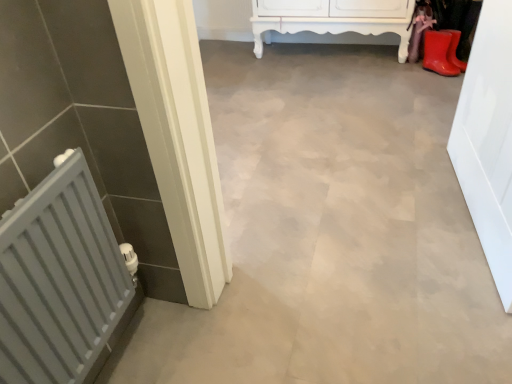
Question: Is the depth of rubber matte boot at upper right greater than that of white glossy door at right?

Choices:
 (A) no
 (B) yes

Answer: (B)

Question: From a real-world perspective, does rubber matte boot at upper right sit lower than white glossy door at right?

Choices:
 (A) yes
 (B) no

Answer: (A)

Question: Can white glossy door at right be found inside rubber matte boot at upper right?

Choices:
 (A) yes
 (B) no

Answer: (B)

Question: Could you tell me if rubber matte boot at upper right is turned towards white glossy door at right?

Choices:
 (A) no
 (B) yes

Answer: (A)

Question: Is rubber matte boot at upper right positioned with its back to white glossy door at right?

Choices:
 (A) yes
 (B) no

Answer: (B)

Question: Is rubber matte boot at upper right taller than white glossy door at right?

Choices:
 (A) yes
 (B) no

Answer: (B)

Question: Is white glossy door at right far away from rubber matte boot at upper right?

Choices:
 (A) yes
 (B) no

Answer: (A)

Question: Is white glossy door at right smaller than rubber matte boot at upper right?

Choices:
 (A) yes
 (B) no

Answer: (B)

Question: From a real-world perspective, does white glossy door at right sit lower than rubber matte boot at upper right?

Choices:
 (A) no
 (B) yes

Answer: (A)

Question: Does white glossy door at right come in front of rubber matte boot at upper right?

Choices:
 (A) yes
 (B) no

Answer: (A)

Question: Is white glossy door at right at the left side of rubber matte boot at upper right?

Choices:
 (A) yes
 (B) no

Answer: (A)

Question: Considering the relative sizes of white glossy door at right and rubber matte boot at upper right in the image provided, is white glossy door at right shorter than rubber matte boot at upper right?

Choices:
 (A) yes
 (B) no

Answer: (B)

Question: From a real-world perspective, is white glossy door at right under gray matte radiator at left?

Choices:
 (A) yes
 (B) no

Answer: (A)